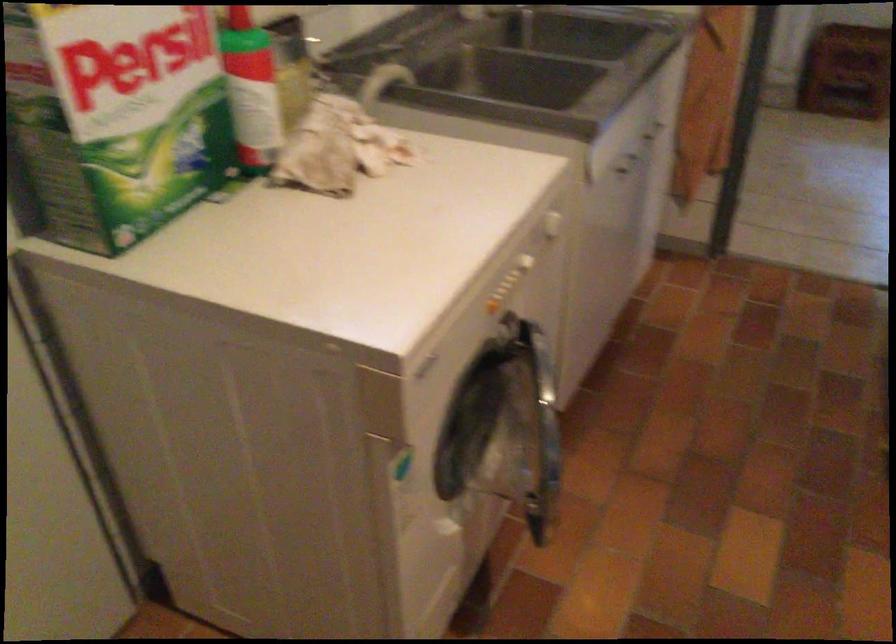
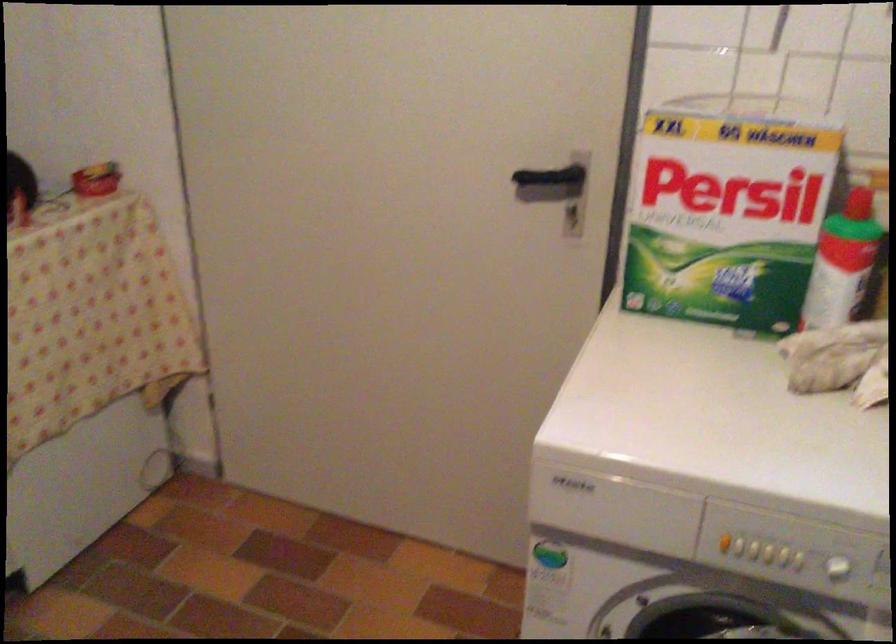
The point at (265, 86) is marked in the first image. Where is the corresponding point in the second image?

(842, 263)